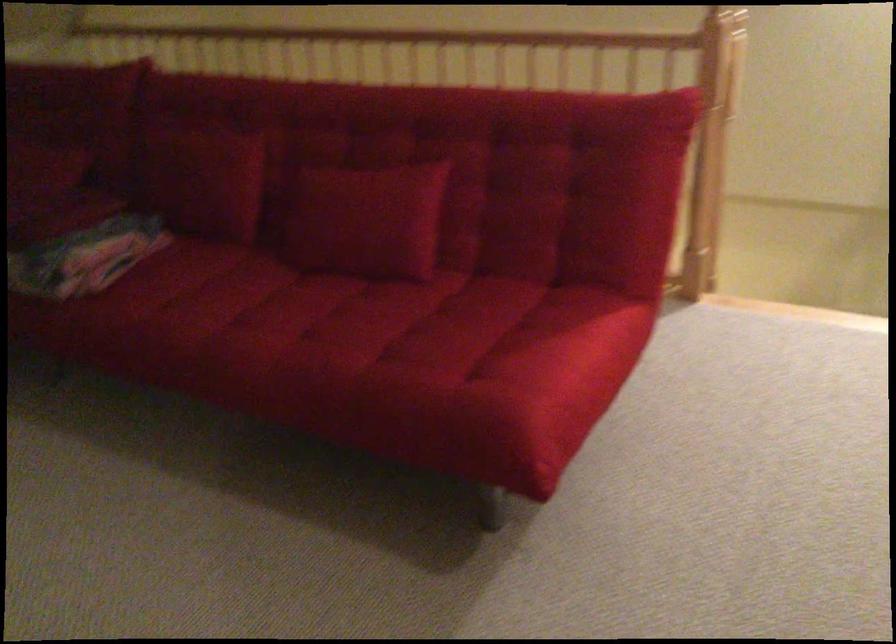
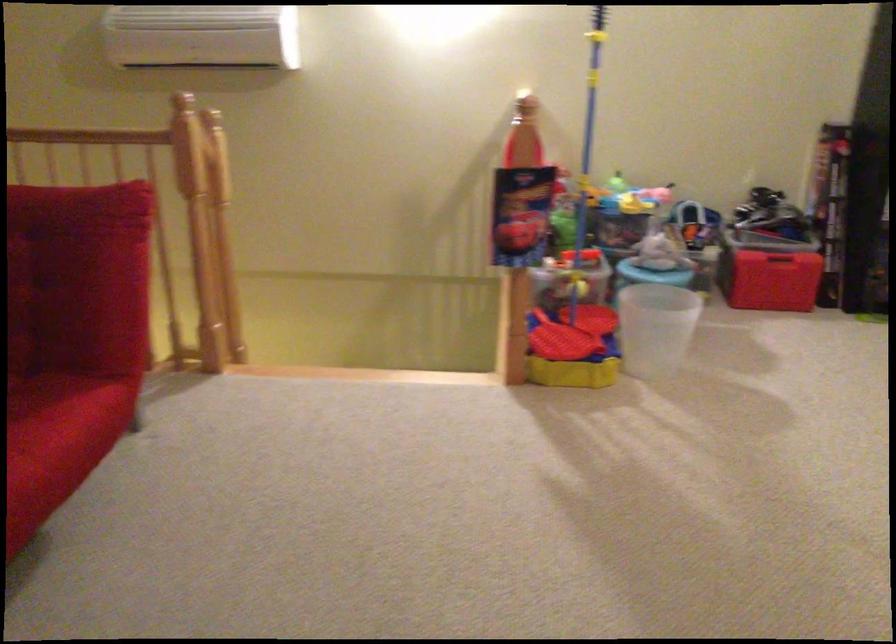
Question: The images are taken continuously from a first-person perspective. In which direction is your viewpoint rotating?

Choices:
 (A) Left
 (B) Right
 (C) Up
 (D) Down

Answer: (B)